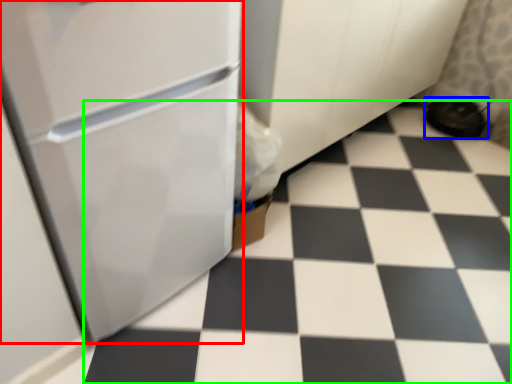
Question: Which object is positioned closest to refrigerator (highlighted by a red box)? Select from footwear (highlighted by a blue box) and tile (highlighted by a green box).

Choices:
 (A) footwear
 (B) tile

Answer: (B)